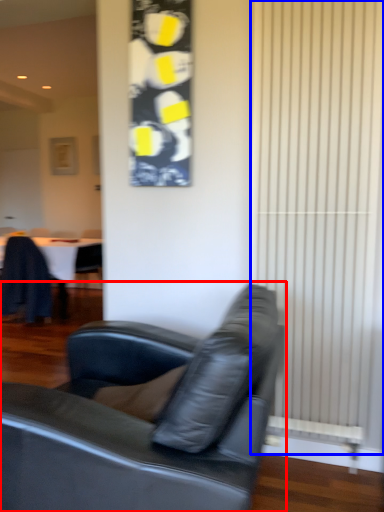
Question: Which point is closer to the camera, studio couch (highlighted by a red box) or curtain (highlighted by a blue box)?

Choices:
 (A) studio couch
 (B) curtain

Answer: (A)